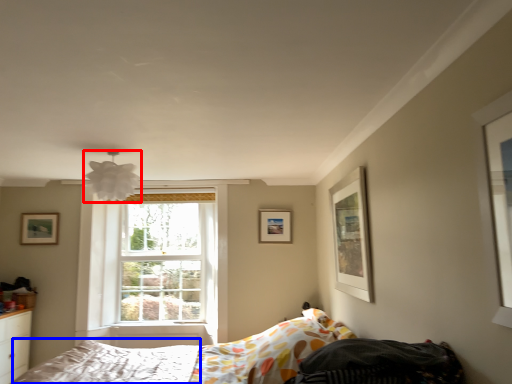
Question: Among these objects, which one is farthest to the camera, lamp (highlighted by a red box) or mattress (highlighted by a blue box)?

Choices:
 (A) lamp
 (B) mattress

Answer: (A)